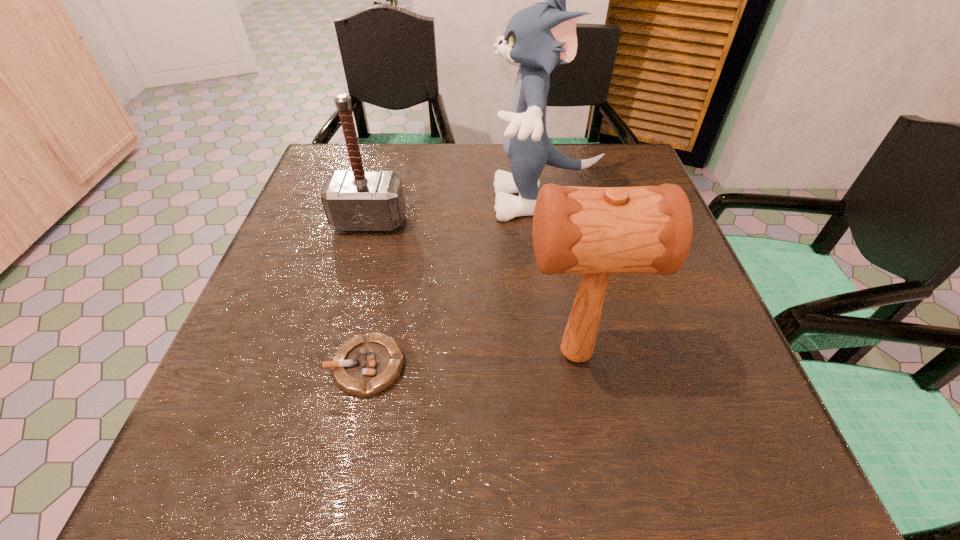
The height and width of the screenshot is (540, 960). I want to click on free space located on the right of the hammer, so click(552, 221).

Locate an element on the screen. free region located on the right of the shortest object is located at coordinates (558, 367).

Locate an element on the screen. The width and height of the screenshot is (960, 540). object at the far edge is located at coordinates (537, 38).

At what (x,y) coordinates should I click in order to perform the action: click on object present at the left edge. Please return your answer as a coordinate pair (x, y). Looking at the image, I should click on (359, 200).

At what (x,y) coordinates should I click in order to perform the action: click on object at the right edge. Please return your answer as a coordinate pair (x, y). Looking at the image, I should click on (537, 38).

I want to click on object that is at the far right corner, so click(x=537, y=38).

Where is `free location at the far edge of the desktop`? The height and width of the screenshot is (540, 960). free location at the far edge of the desktop is located at coordinates click(540, 187).

Locate an element on the screen. free space at the near edge of the desktop is located at coordinates (x=612, y=452).

I want to click on vacant space at the left edge of the desktop, so click(232, 404).

What are the coordinates of `vacant region at the right edge` in the screenshot? It's located at (669, 319).